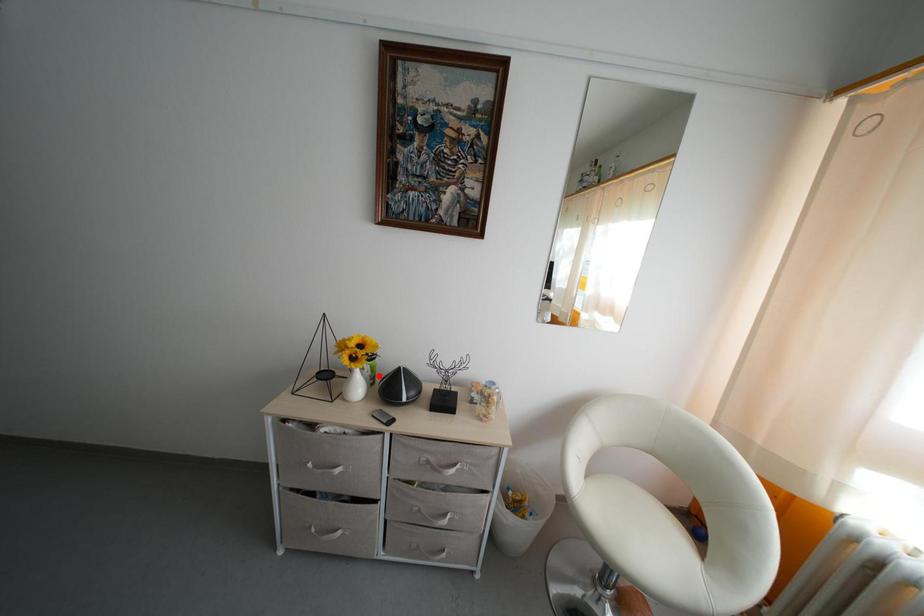
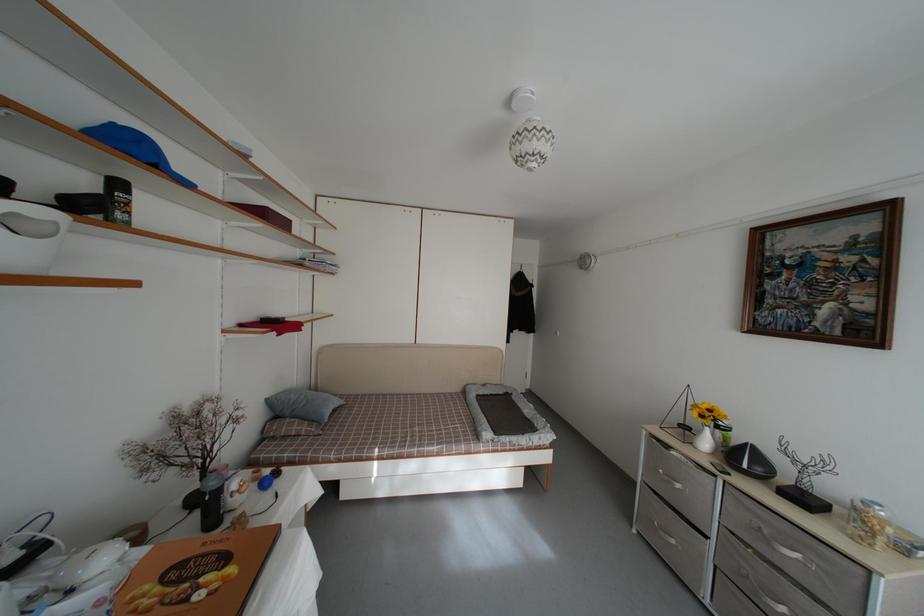
The point at the highlighted location is marked in the first image. Where is the corresponding point in the second image?

(731, 446)